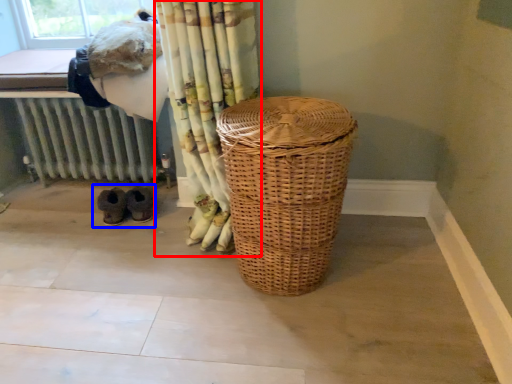
Question: Which of the following is the farthest to the observer, curtain (highlighted by a red box) or footwear (highlighted by a blue box)?

Choices:
 (A) curtain
 (B) footwear

Answer: (B)